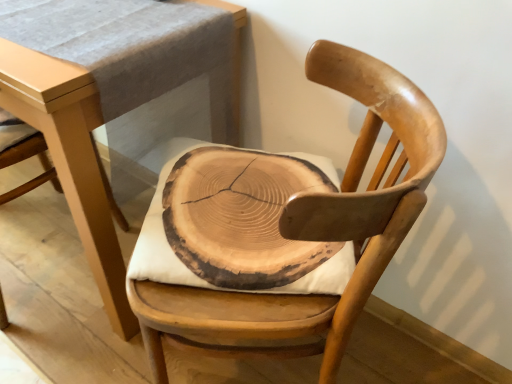
Question: Considering the positions of wooden slice cushion at center and light brown wood table at center in the image, is wooden slice cushion at center wider or thinner than light brown wood table at center?

Choices:
 (A) thin
 (B) wide

Answer: (A)

Question: Considering their positions, is wooden slice cushion at center located in front of or behind light brown wood table at center?

Choices:
 (A) behind
 (B) front

Answer: (A)

Question: Which object is positioned closest to the wooden slice cushion at center?

Choices:
 (A) light brown wood table at center
 (B) natural wood chair at center

Answer: (B)

Question: Which object is positioned closest to the light brown wood table at center?

Choices:
 (A) natural wood chair at center
 (B) wooden slice cushion at center

Answer: (B)